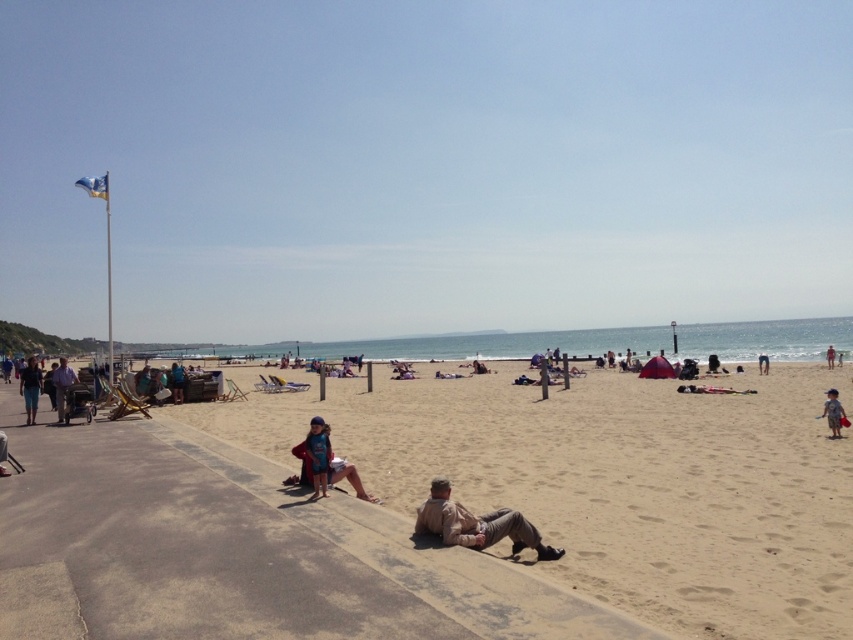
Question: Is matte blue swimsuit at center wider than blue denim shorts at left?

Choices:
 (A) no
 (B) yes

Answer: (A)

Question: In this image, where is light brown sand at lower center located relative to light blue fabric swimsuit at lower right?

Choices:
 (A) above
 (B) below

Answer: (B)

Question: Which of the following is the farthest from the observer?

Choices:
 (A) light blue fabric swimsuit at lower right
 (B) light blue denim shorts at lower right

Answer: (A)

Question: Is matte blue swimsuit at center bigger than blue fabric bag at center?

Choices:
 (A) yes
 (B) no

Answer: (B)

Question: Which point appears farthest from the camera in this image?

Choices:
 (A) (761, 369)
 (B) (335, 476)
 (C) (32, 365)
 (D) (828, 349)

Answer: (D)

Question: Which point is farther to the camera?

Choices:
 (A) (57, 419)
 (B) (318, 435)
 (C) (444, 477)

Answer: (A)